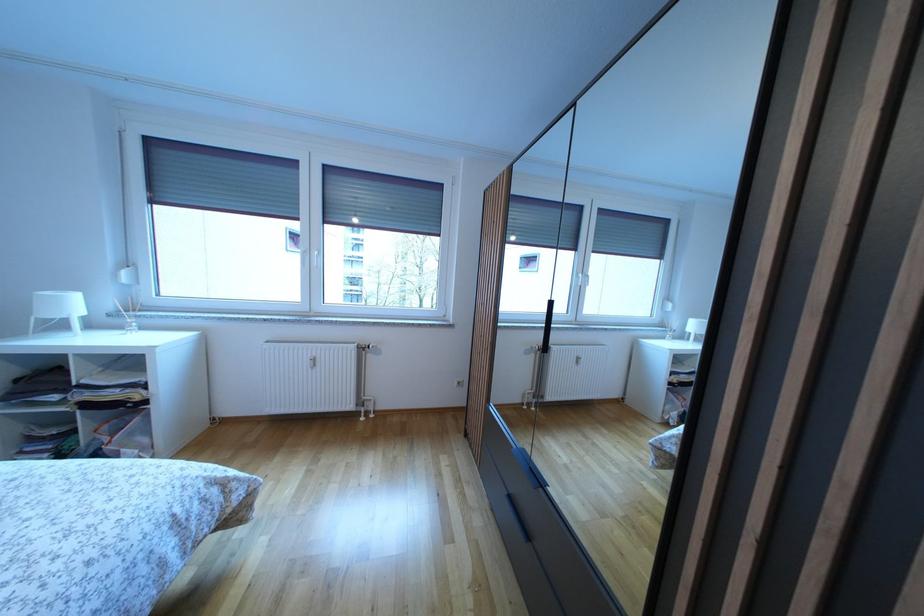
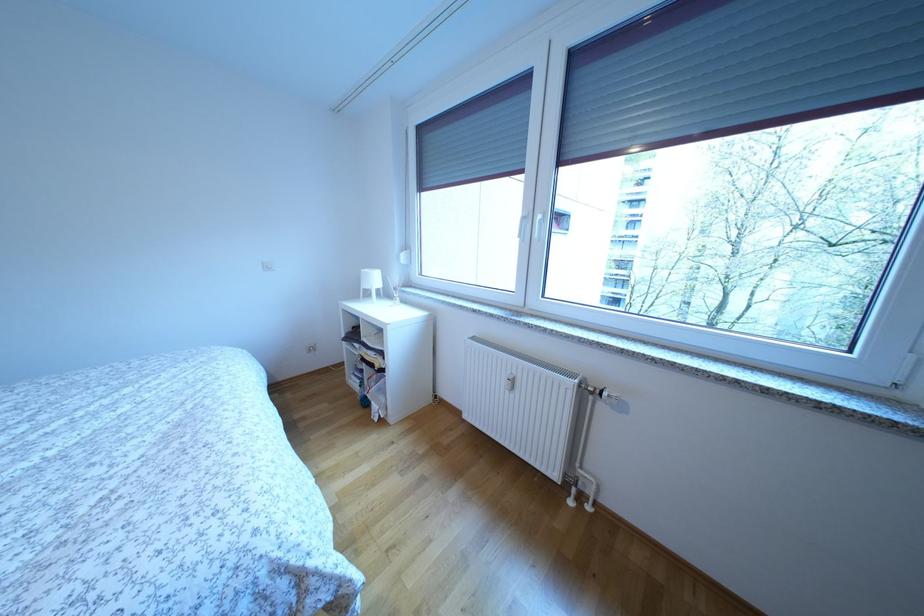
Where in the second image is the point corresponding to [78,310] from the first image?

(382, 285)